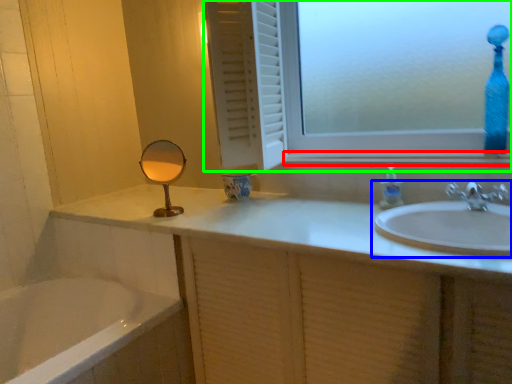
Question: Which object is the closest to the window sill (highlighted by a red box)? Choose among these: sink (highlighted by a blue box) or window (highlighted by a green box).

Choices:
 (A) sink
 (B) window

Answer: (B)